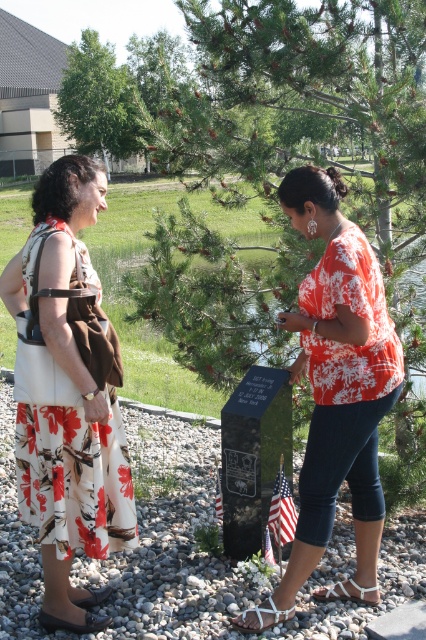
You are a photographer trying to capture a closeup of the orange floral blouse at center and the white fabric sandal at lower center. Which object should you focus on first if you want to start with the one closer to the camera?

The orange floral blouse at center is to the left of white fabric sandal at lower center, so the photographer should focus on the orange floral blouse at center first as it is closer to the camera.

Looking at this image, you are a photographer trying to capture the memorial marker in the background while ensuring both women are in the frame. Given the position of the white floral dress at left at point (66, 387), where should you position yourself to include all elements?

Position yourself so that the white floral dress at left at point (66, 387) is centered in your viewfinder. This will ensure the memorial marker in the background and the other woman are also within the frame.

You are a photographer standing at the camera position. You want to take a photo of the orange floral blouse at center. Can you estimate how far you need to move forward or backward to focus on it?

The orange floral blouse at center is 3.11 meters away from the camera, so you need to adjust your focus to that distance without needing to move physically, as modern cameras can focus automatically at that range.